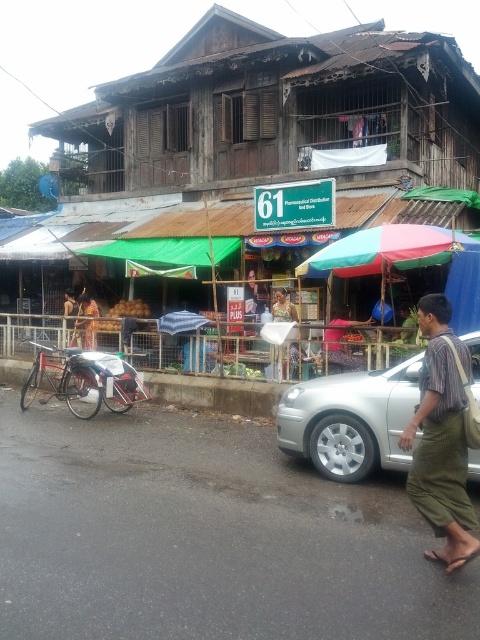
You are a tourist standing on the street and want to take a photo of the wooden hut at center and the golden fabric person at center. Which object should you focus on first if you want to capture both in the same frame without moving your camera?

You should focus on the wooden hut at center first because it is taller than the golden fabric person at center, allowing you to adjust the camera angle to include both in the frame.

Looking at this image, you are a delivery person standing at the edge of the market. You need to deliver a package to the wooden hut at center and then to the golden fabric person at center. What is the shortest path you can take between the two locations?

The shortest path between the wooden hut at center and the golden fabric person at center is 15.63 feet, so you can walk directly between them without taking any detours.